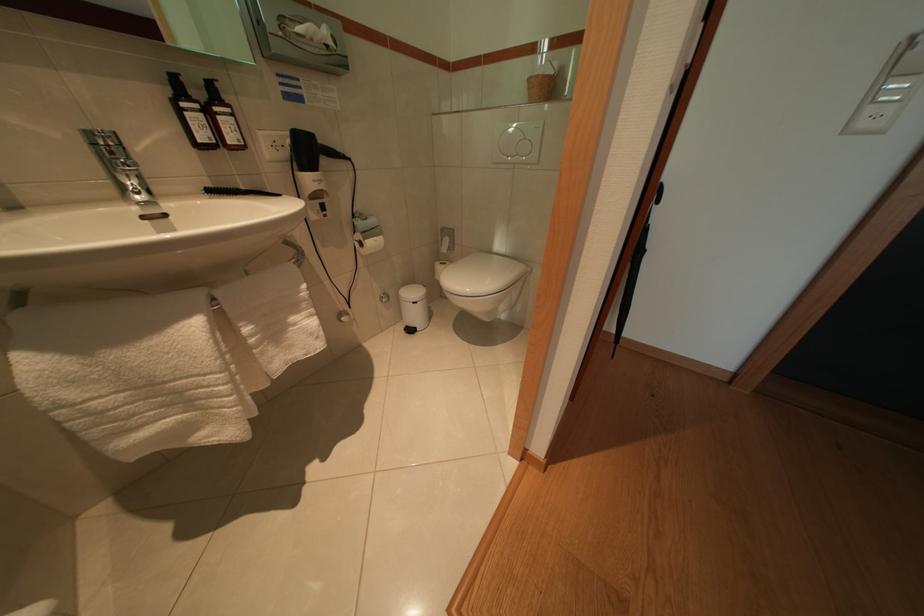
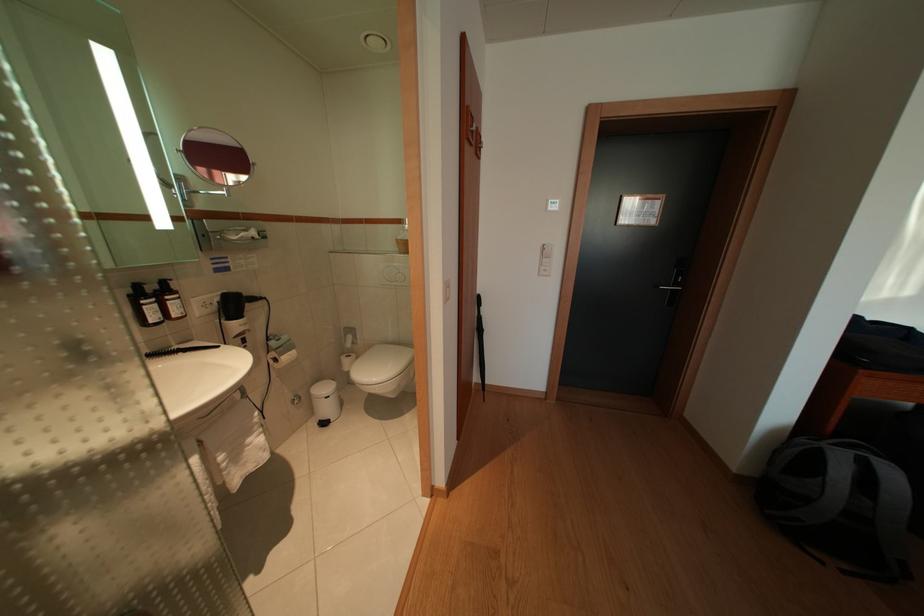
In the second image, find the point that corresponds to [422,322] in the first image.

(335, 415)